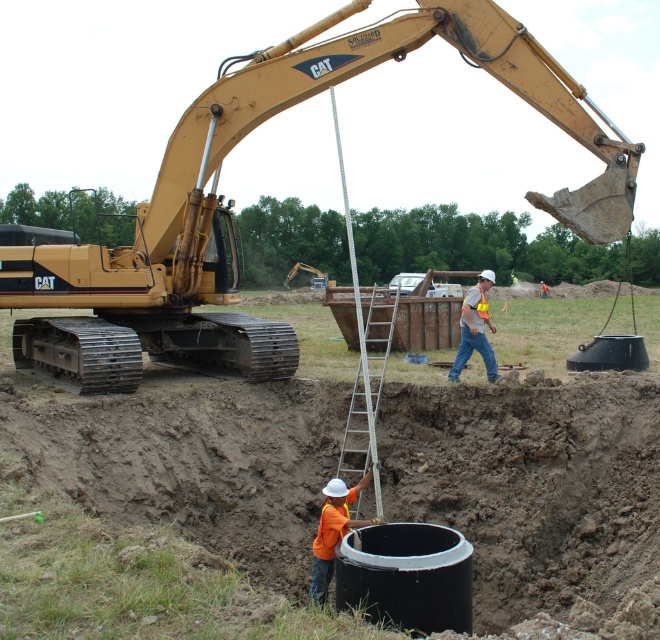
You are a safety inspector observing the construction site. You notice the yellow metallic excavator at upper left and the orange fabric construction worker at lower center. According to safety protocols, heavy machinery should not operate above workers. Is there a potential safety hazard here?

Yes, there is a potential safety hazard because the yellow metallic excavator at upper left is above the orange fabric construction worker at lower center, violating safety protocols that prohibit operating heavy machinery above workers.

From the picture: You are a safety inspector at the construction site. You notice the yellow metallic excavator at upper left and the orange reflective vest at center. According to safety regulations, heavy machinery must maintain a minimum distance of 2 meters from any worker. Is the current positioning compliant with this rule?

The yellow metallic excavator at upper left is positioned over orange reflective vest at center, which means they are too close to comply with the 2 meter safety distance requirement. The excavator needs to be moved further away from the worker in orange reflective vest at center.